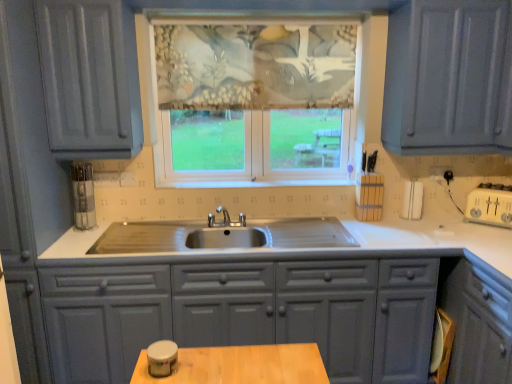
Question: Choose the correct answer: Is textured fabric window at center inside textured floral fabric at center or outside it?

Choices:
 (A) outside
 (B) inside

Answer: (B)

Question: From the image's perspective, is textured fabric window at center above or below textured floral fabric at center?

Choices:
 (A) above
 (B) below

Answer: (B)

Question: Estimate the real-world distances between objects in this image. Which object is closer to the matte gray cabinets at center?

Choices:
 (A) textured floral fabric at center
 (B) textured fabric window at center

Answer: (B)

Question: Estimate the real-world distances between objects in this image. Which object is farther from the textured fabric window at center?

Choices:
 (A) textured floral fabric at center
 (B) matte gray cabinets at center

Answer: (B)